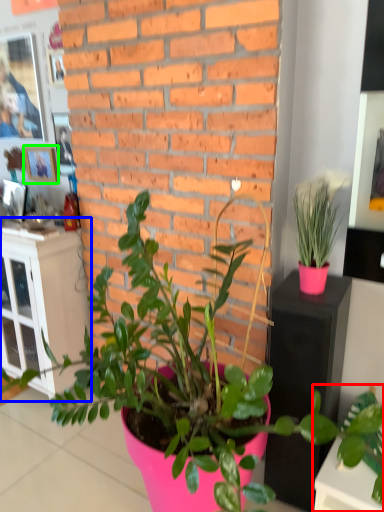
Question: Considering the real-world distances, which object is closest to houseplant (highlighted by a red box)? file cabinet (highlighted by a blue box) or picture frame (highlighted by a green box).

Choices:
 (A) file cabinet
 (B) picture frame

Answer: (A)